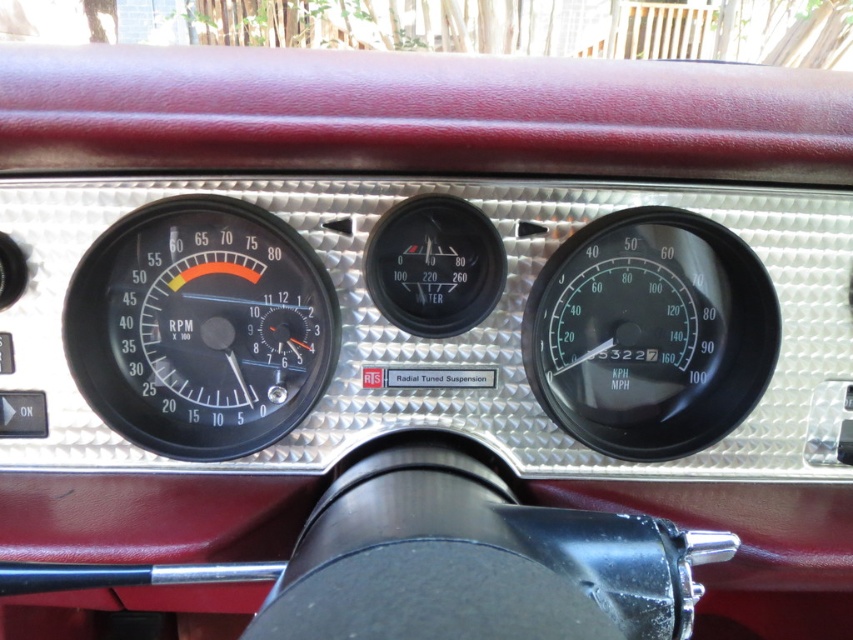
Can you confirm if black rubber tachometer at left is positioned below black plastic speedometer at center right?

Incorrect, black rubber tachometer at left is not positioned below black plastic speedometer at center right.

Is black rubber tachometer at left shorter than black plastic speedometer at center right?

Incorrect, black rubber tachometer at left's height does not fall short of black plastic speedometer at center right's.

Who is more distant from viewer, (x=241, y=365) or (x=769, y=360)?

Positioned behind is point (x=241, y=365).

The width and height of the screenshot is (853, 640). Identify the location of black rubber tachometer at left. (200, 326).